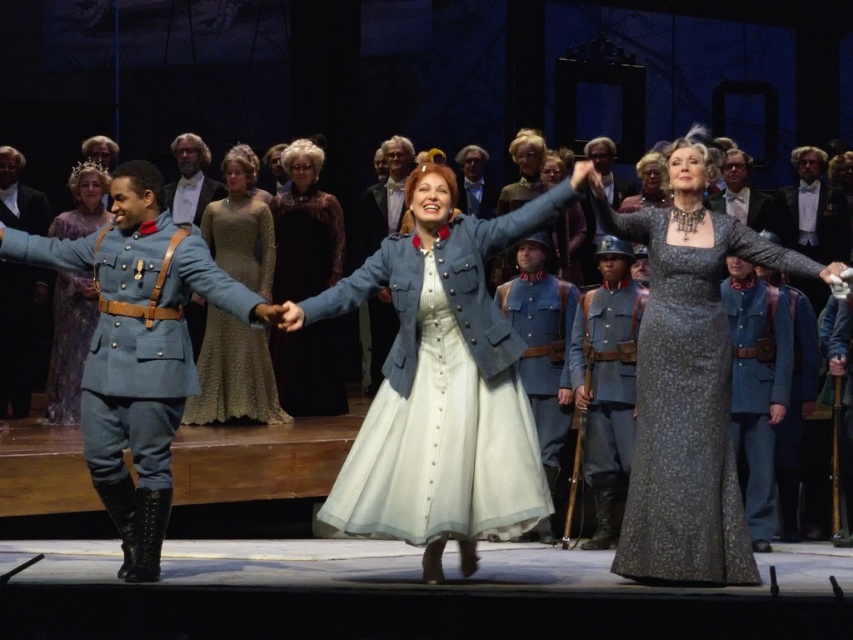
You are designing a stage set and need to place both the light blue fabric uniform at left and the matte blue dress at center on a narrow platform. Which item should you place closer to the edge to prevent them from overlapping?

The light blue fabric uniform at left might be wider than the matte blue dress at center, so placing the wider uniform closer to the edge would prevent overlap.

What object is located at the coordinates point (16, 333) in the image?

The point (16, 333) indicates the black leather jacket at left.

You are a stagehand responsible for adjusting the lighting during the performance. You need to ensure that the light blue fabric uniform at left and the matte blue dress at center are both adequately lit. Based on their positions, which object is closer to the stage floor?

The light blue fabric uniform at left is located below the matte blue dress at center, meaning it is closer to the stage floor.